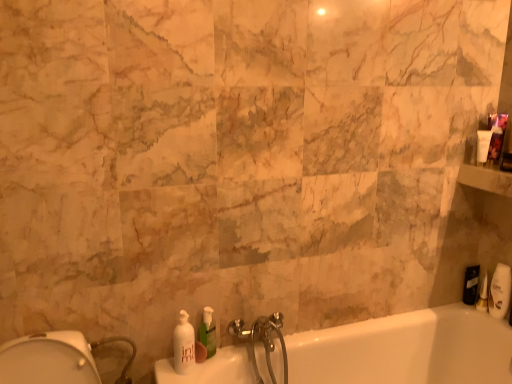
Question: Can you confirm if white glossy soap dispenser at lower left, positioned as the 1th soap dispenser in left-to-right order, is positioned to the right of black matte toiletry at right, which is counted as the 1th toiletry, starting from the back?

Choices:
 (A) no
 (B) yes

Answer: (A)

Question: Can you confirm if white glossy soap dispenser at lower left, the second soap dispenser positioned from the right, is positioned to the left of black matte toiletry at right, which is counted as the 1th toiletry, starting from the back?

Choices:
 (A) no
 (B) yes

Answer: (B)

Question: Is the position of white glossy soap dispenser at lower left, positioned as the 1th soap dispenser in left-to-right order, less distant than that of black matte toiletry at right, which is counted as the 1th toiletry, starting from the back?

Choices:
 (A) yes
 (B) no

Answer: (A)

Question: Can you confirm if white glossy soap dispenser at lower left, the second soap dispenser positioned from the right, is smaller than black matte toiletry at right, which is counted as the 1th toiletry, starting from the back?

Choices:
 (A) no
 (B) yes

Answer: (A)

Question: Is the depth of white glossy soap dispenser at lower left, the second soap dispenser positioned from the right, greater than that of black matte toiletry at right, which is counted as the 1th toiletry, starting from the back?

Choices:
 (A) no
 (B) yes

Answer: (A)

Question: Based on their positions, is green translucent soap dispenser at lower center, the 2th soap dispenser when ordered from left to right, located to the left or right of white glossy soap dispenser at lower left, positioned as the 1th soap dispenser in left-to-right order?

Choices:
 (A) left
 (B) right

Answer: (B)

Question: Is green translucent soap dispenser at lower center, which ranks as the first soap dispenser in right-to-left order, in front of or behind white glossy soap dispenser at lower left, positioned as the 1th soap dispenser in left-to-right order, in the image?

Choices:
 (A) behind
 (B) front

Answer: (A)

Question: Looking at the image, does green translucent soap dispenser at lower center, which ranks as the first soap dispenser in right-to-left order, seem bigger or smaller compared to white glossy soap dispenser at lower left, positioned as the 1th soap dispenser in left-to-right order?

Choices:
 (A) small
 (B) big

Answer: (A)

Question: From a real-world perspective, is green translucent soap dispenser at lower center, the 2th soap dispenser when ordered from left to right, above or below white glossy soap dispenser at lower left, the second soap dispenser positioned from the right?

Choices:
 (A) above
 (B) below

Answer: (A)

Question: From a real-world perspective, is white glossy bathtub at lower right above or below white glossy soap dispenser at lower left, the second soap dispenser positioned from the right?

Choices:
 (A) above
 (B) below

Answer: (B)

Question: Does point (320, 334) appear closer or farther from the camera than point (186, 365)?

Choices:
 (A) farther
 (B) closer

Answer: (A)

Question: In the image, is white glossy bathtub at lower right positioned in front of or behind white glossy soap dispenser at lower left, positioned as the 1th soap dispenser in left-to-right order?

Choices:
 (A) front
 (B) behind

Answer: (A)

Question: Which is correct: white glossy bathtub at lower right is inside white glossy soap dispenser at lower left, positioned as the 1th soap dispenser in left-to-right order, or outside of it?

Choices:
 (A) outside
 (B) inside

Answer: (A)

Question: From the image's perspective, is white glossy soap dispenser at lower left, positioned as the 1th soap dispenser in left-to-right order, above or below white glossy bathtub at lower right?

Choices:
 (A) above
 (B) below

Answer: (A)

Question: Is white glossy soap dispenser at lower left, positioned as the 1th soap dispenser in left-to-right order, taller or shorter than white glossy bathtub at lower right?

Choices:
 (A) short
 (B) tall

Answer: (A)